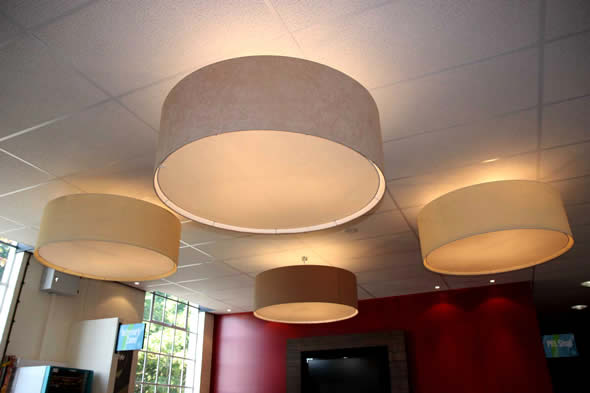
Identify the location of frame. (403, 348).